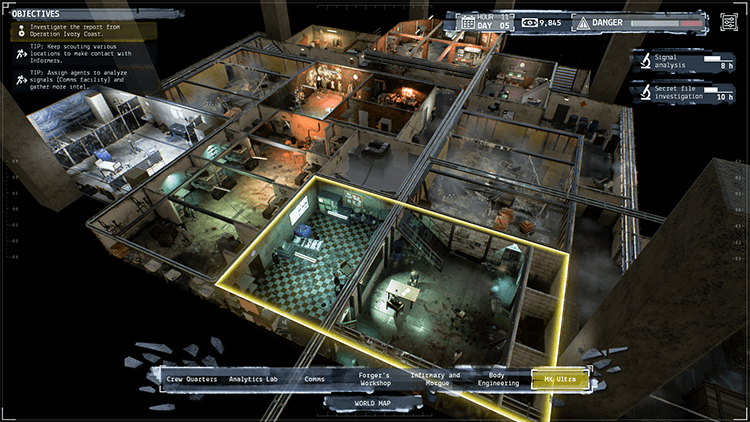
Image resolution: width=750 pixels, height=422 pixels. Find the location of `table`. table is located at coordinates (400, 290).